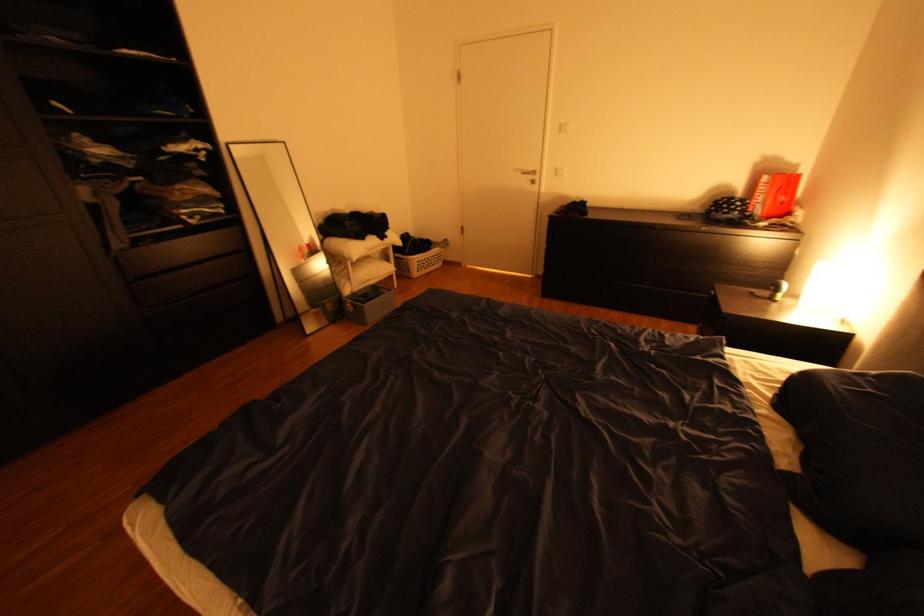
Find where to pull the black drawer front. Please return your answer as a coordinate pair (x, y).

(657, 261)